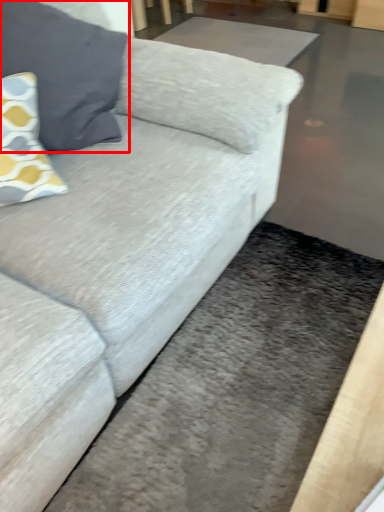
Question: From the image's perspective, what is the correct spatial relationship of pillow (annotated by the red box) in relation to flat?

Choices:
 (A) above
 (B) below

Answer: (B)